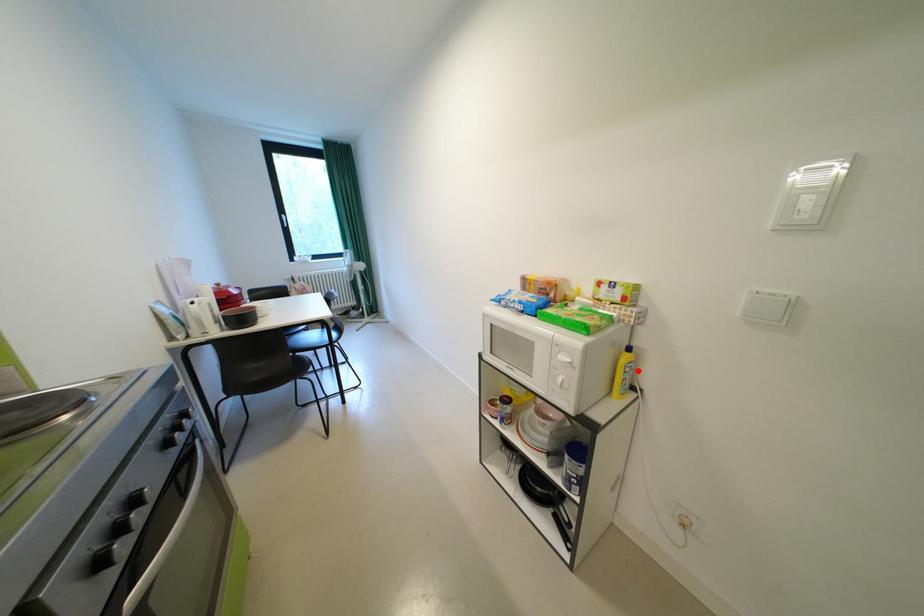
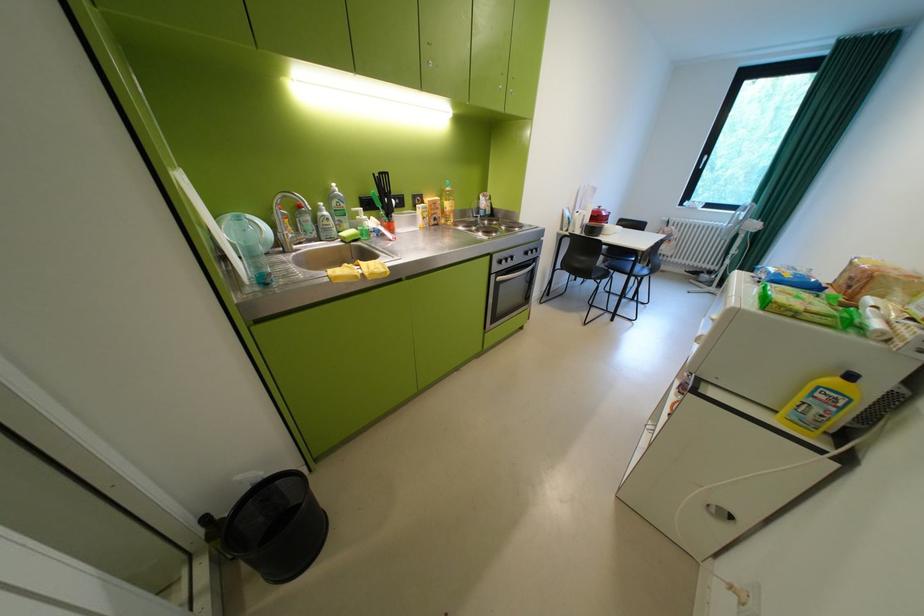
Find the pixel in the second image that matches the highlighted location in the first image.

(830, 395)